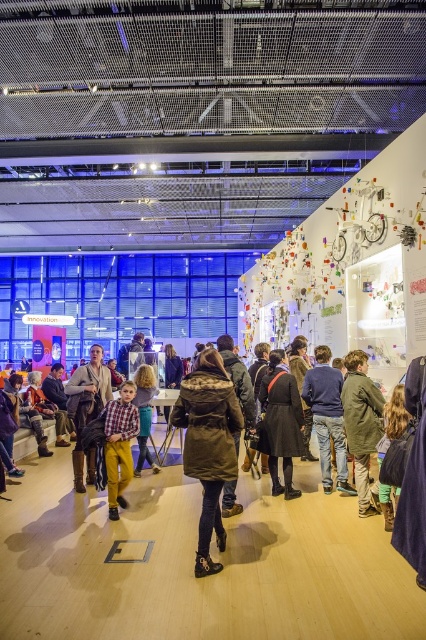
Question: Can you confirm if plaid shirt at center is positioned to the left of dark blue sweater at center?

Choices:
 (A) no
 (B) yes

Answer: (A)

Question: Which point appears closest to the camera in this image?

Choices:
 (A) (88, 451)
 (B) (290, 454)

Answer: (B)

Question: Is black leather coat at center above green textured jacket at lower right?

Choices:
 (A) no
 (B) yes

Answer: (A)

Question: Which point appears farthest from the camera in this image?

Choices:
 (A) (374, 486)
 (B) (94, 372)
 (C) (213, 426)

Answer: (B)

Question: Which is nearer to the plaid shirt at center?

Choices:
 (A) green textured jacket at lower right
 (B) black leather coat at center
 (C) dark green textured coat at center

Answer: (A)

Question: Does dark green textured coat at center have a greater width compared to black leather coat at center?

Choices:
 (A) yes
 (B) no

Answer: (A)